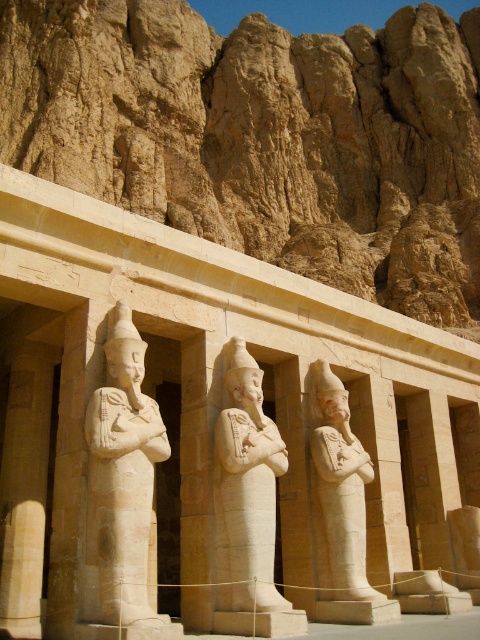
Can you confirm if beige stone statue at center is smaller than white stone statue at center?

No.

Does beige stone statue at center have a greater height compared to white stone statue at center?

Correct, beige stone statue at center is much taller as white stone statue at center.

Is point (252, 536) positioned behind point (313, 390)?

No, it is not.

Find the location of a particular element. The image size is (480, 640). beige stone statue at center is located at coordinates (248, 506).

Between point (168, 156) and point (324, 424), which one is positioned in front?

Point (324, 424)

Between beige stone rock formation at upper center and white stone statue at center, which one is positioned higher?

Positioned higher is beige stone rock formation at upper center.

This screenshot has height=640, width=480. In order to click on beige stone rock formation at upper center in this screenshot , I will do `click(264, 138)`.

Where is `beige stone rock formation at upper center`? This screenshot has height=640, width=480. beige stone rock formation at upper center is located at coordinates (264, 138).

Does beige stone rock formation at upper center have a lesser height compared to smooth beige statue at center?

No, beige stone rock formation at upper center is not shorter than smooth beige statue at center.

Is point (118, 180) closer to camera compared to point (145, 573)?

That is False.

Identify the location of beige stone rock formation at upper center. This screenshot has width=480, height=640. (264, 138).